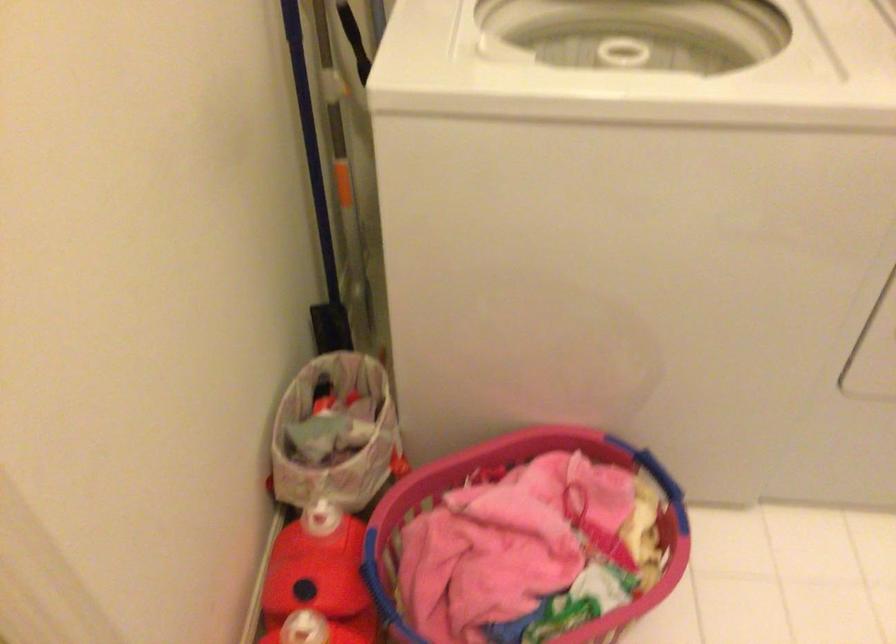
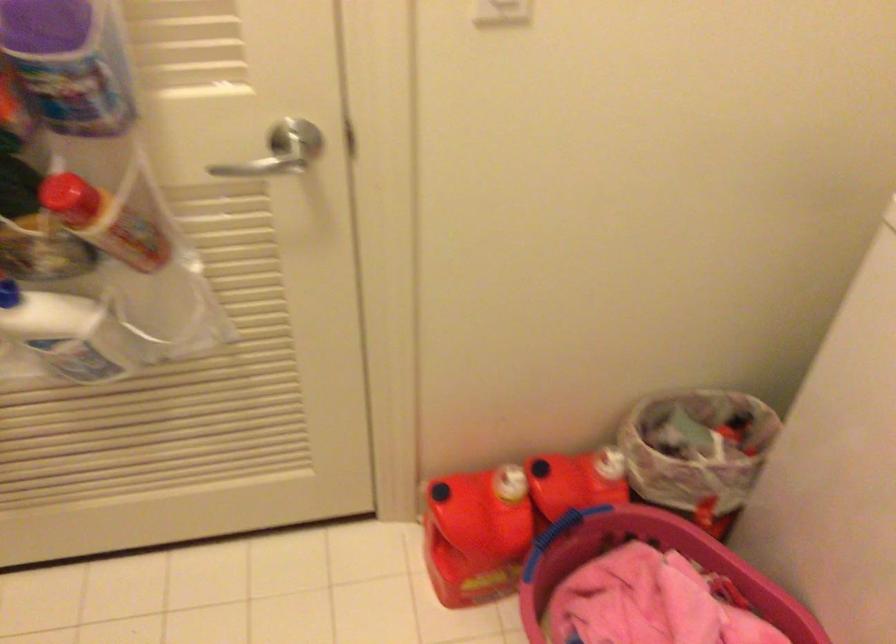
Locate, in the second image, the point that corresponds to point (450, 535) in the first image.

(647, 565)